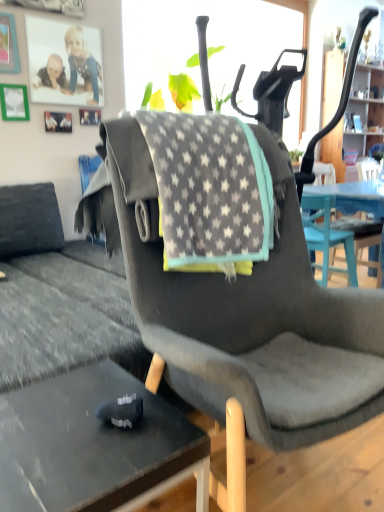
Image resolution: width=384 pixels, height=512 pixels. Describe the element at coordinates (251, 317) in the screenshot. I see `dark gray fabric chair at center` at that location.

The height and width of the screenshot is (512, 384). What are the coordinates of `wooden cabinet at upper right` in the screenshot? It's located at (332, 83).

The height and width of the screenshot is (512, 384). Identify the location of black glass desk at lower left. point(93,445).

Is gray star-patterned fabric at center to the left or to the right of black glass desk at lower left in the image?

Clearly, gray star-patterned fabric at center is on the right of black glass desk at lower left in the image.

From a real-world perspective, relative to black glass desk at lower left, is gray star-patterned fabric at center vertically above or below?

From a real-world perspective, gray star-patterned fabric at center is physically above black glass desk at lower left.

Can you see gray star-patterned fabric at center touching black glass desk at lower left?

No, gray star-patterned fabric at center is not making contact with black glass desk at lower left.

What are the coordinates of `blanket located on the right of black glass desk at lower left` in the screenshot? It's located at (209, 191).

Considering the positions of objects wooden cabinet at upper right and dark gray fabric chair at center in the image provided, who is more to the right, wooden cabinet at upper right or dark gray fabric chair at center?

wooden cabinet at upper right.

Which object is closer to the camera, wooden cabinet at upper right or dark gray fabric chair at center?

dark gray fabric chair at center is in front.

Which is in front, point (113, 389) or point (219, 269)?

The point (113, 389) is closer to the camera.

In the scene shown: Can you confirm if black glass desk at lower left is wider than gray star-patterned fabric at center?

In fact, black glass desk at lower left might be narrower than gray star-patterned fabric at center.

Are black glass desk at lower left and gray star-patterned fabric at center far apart?

No, black glass desk at lower left is in close proximity to gray star-patterned fabric at center.

Does black glass desk at lower left have a larger size compared to gray star-patterned fabric at center?

Actually, black glass desk at lower left might be smaller than gray star-patterned fabric at center.

Looking at this image, from a real-world perspective, who is located higher, gray star-patterned fabric at center or wooden cabinet at upper right?

From a 3D spatial view, wooden cabinet at upper right is above.

Is gray star-patterned fabric at center positioned before wooden cabinet at upper right?

Yes, the depth of gray star-patterned fabric at center is less than that of wooden cabinet at upper right.

Measure the distance from gray star-patterned fabric at center to wooden cabinet at upper right.

gray star-patterned fabric at center and wooden cabinet at upper right are 2.50 meters apart.

Is gray star-patterned fabric at center facing away from wooden cabinet at upper right?

No, gray star-patterned fabric at center is not facing away from wooden cabinet at upper right.

Where is `desk behind the dark gray fabric chair at center`? desk behind the dark gray fabric chair at center is located at coordinates (93, 445).

Which object is further away from the camera, black glass desk at lower left or dark gray fabric chair at center?

black glass desk at lower left is further from the camera.

Between black glass desk at lower left and dark gray fabric chair at center, which one has larger width?

With larger width is dark gray fabric chair at center.

From a real-world perspective, is black glass desk at lower left positioned under dark gray fabric chair at center based on gravity?

Indeed, from a real-world perspective, black glass desk at lower left is positioned beneath dark gray fabric chair at center.

Which is behind, point (357, 417) or point (227, 186)?

The point (227, 186) is behind.

How far apart are dark gray fabric chair at center and gray star-patterned fabric at center?

They are 6.89 inches apart.

Is there a large distance between dark gray fabric chair at center and gray star-patterned fabric at center?

No, there isn't a large distance between dark gray fabric chair at center and gray star-patterned fabric at center.

Is dark gray fabric chair at center thinner than gray star-patterned fabric at center?

No.

From a real-world perspective, is gray star-patterned fabric at center on top of dark gray fabric chair at center?

Yes, from a real-world perspective, gray star-patterned fabric at center is over dark gray fabric chair at center

Which object is positioned more to the right, gray star-patterned fabric at center or dark gray fabric chair at center?

From the viewer's perspective, dark gray fabric chair at center appears more on the right side.

From the image's perspective, relative to dark gray fabric chair at center, is gray star-patterned fabric at center above or below?

gray star-patterned fabric at center is above dark gray fabric chair at center.

Would you say gray star-patterned fabric at center is a long distance from dark gray fabric chair at center?

No, gray star-patterned fabric at center is in close proximity to dark gray fabric chair at center.

Find the location of `blanket on the right of the black glass desk at lower left`. blanket on the right of the black glass desk at lower left is located at coordinates (209, 191).

The width and height of the screenshot is (384, 512). Identify the location of chair that is below the wooden cabinet at upper right (from the image's perspective). (251, 317).

In the scene shown: Considering their positions, is wooden cabinet at upper right positioned closer to gray star-patterned fabric at center than dark gray fabric chair at center?

The object closer to gray star-patterned fabric at center is dark gray fabric chair at center.

Looking at the image, which one is located closer to wooden cabinet at upper right, black glass desk at lower left or dark gray fabric chair at center?

dark gray fabric chair at center.

Considering their positions, is black glass desk at lower left positioned closer to gray star-patterned fabric at center than dark gray fabric chair at center?

The object closer to gray star-patterned fabric at center is dark gray fabric chair at center.

When comparing their distances from gray star-patterned fabric at center, does dark gray fabric chair at center or black glass desk at lower left seem further?

black glass desk at lower left.

Looking at the image, which one is located further to wooden cabinet at upper right, dark gray fabric chair at center or black glass desk at lower left?

Among the two, black glass desk at lower left is located further to wooden cabinet at upper right.

When comparing their distances from dark gray fabric chair at center, does wooden cabinet at upper right or gray star-patterned fabric at center seem closer?

The object closer to dark gray fabric chair at center is gray star-patterned fabric at center.

Considering their positions, is gray star-patterned fabric at center positioned closer to dark gray fabric chair at center than black glass desk at lower left?

gray star-patterned fabric at center lies closer to dark gray fabric chair at center than the other object.

Considering their positions, is gray star-patterned fabric at center positioned closer to black glass desk at lower left than wooden cabinet at upper right?

gray star-patterned fabric at center.

At what (x,y) coordinates should I click in order to perform the action: click on blanket between black glass desk at lower left and wooden cabinet at upper right from front to back. Please return your answer as a coordinate pair (x, y). The image size is (384, 512). Looking at the image, I should click on (209, 191).

The width and height of the screenshot is (384, 512). Identify the location of blanket between dark gray fabric chair at center and wooden cabinet at upper right along the z-axis. (209, 191).

I want to click on desk between dark gray fabric chair at center and wooden cabinet at upper right from front to back, so click(93, 445).

Find the location of a particular element. The width and height of the screenshot is (384, 512). chair that lies between gray star-patterned fabric at center and black glass desk at lower left from top to bottom is located at coordinates (251, 317).